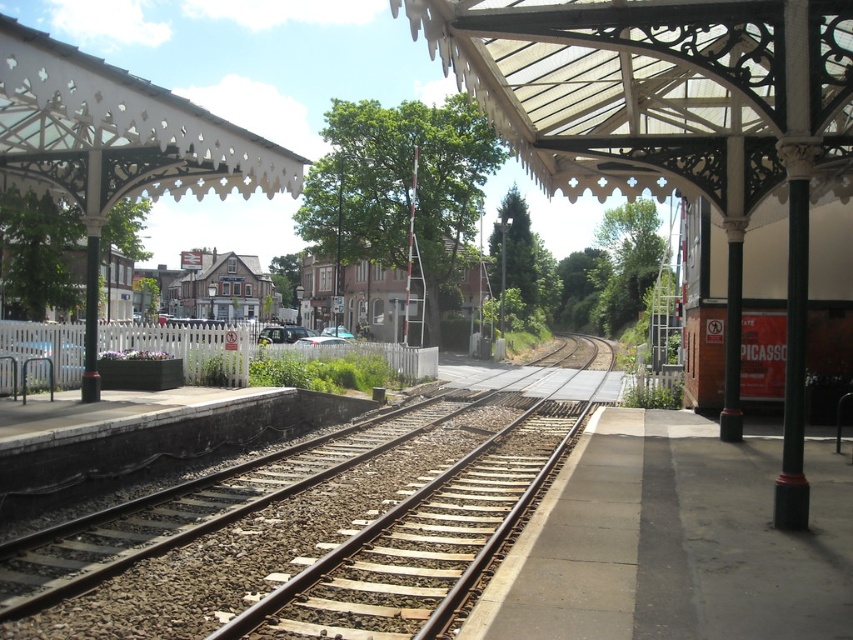
The width and height of the screenshot is (853, 640). I want to click on brown gravel train track at center, so click(318, 524).

What do you see at coordinates (318, 524) in the screenshot?
I see `brown gravel train track at center` at bounding box center [318, 524].

Image resolution: width=853 pixels, height=640 pixels. What are the coordinates of `brown gravel train track at center` in the screenshot? It's located at (318, 524).